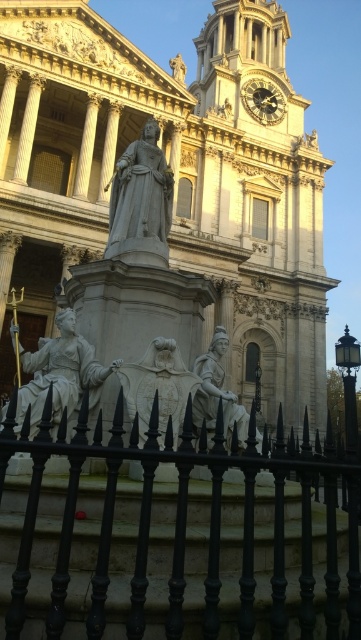
Question: Which point appears closest to the camera in this image?

Choices:
 (A) (268, 88)
 (B) (150, 188)
 (C) (281, 145)

Answer: (B)

Question: Which object is farther from the camera taking this photo?

Choices:
 (A) white marble statue at center
 (B) gold metallic clock at upper center
 (C) polished bronze statue at center
 (D) white stone church at center

Answer: (B)

Question: Does white stone church at center have a smaller size compared to polished bronze statue at center?

Choices:
 (A) no
 (B) yes

Answer: (A)

Question: Does white marble statue at center appear over polished bronze statue at center?

Choices:
 (A) yes
 (B) no

Answer: (A)

Question: Which object is positioned farthest from the white marble statue at center?

Choices:
 (A) white stone church at center
 (B) polished bronze statue at center
 (C) gray stone statue at center
 (D) black wrought iron fence at lower center

Answer: (A)

Question: Observing the image, what is the correct spatial positioning of white stone church at center in reference to black wrought iron fence at lower center?

Choices:
 (A) left
 (B) right

Answer: (A)